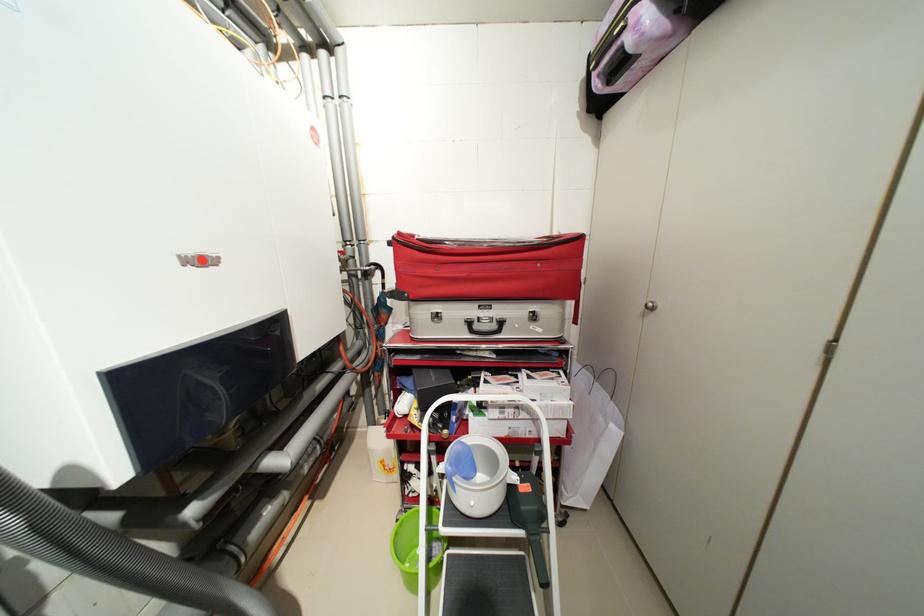
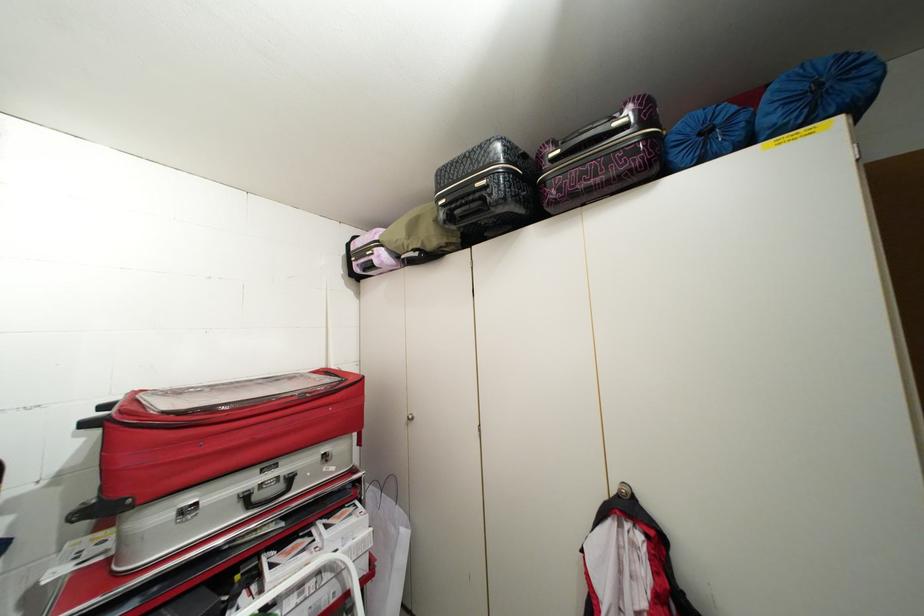
Where in the second image is the point corresponding to point 502,326 from the first image?

(287, 487)